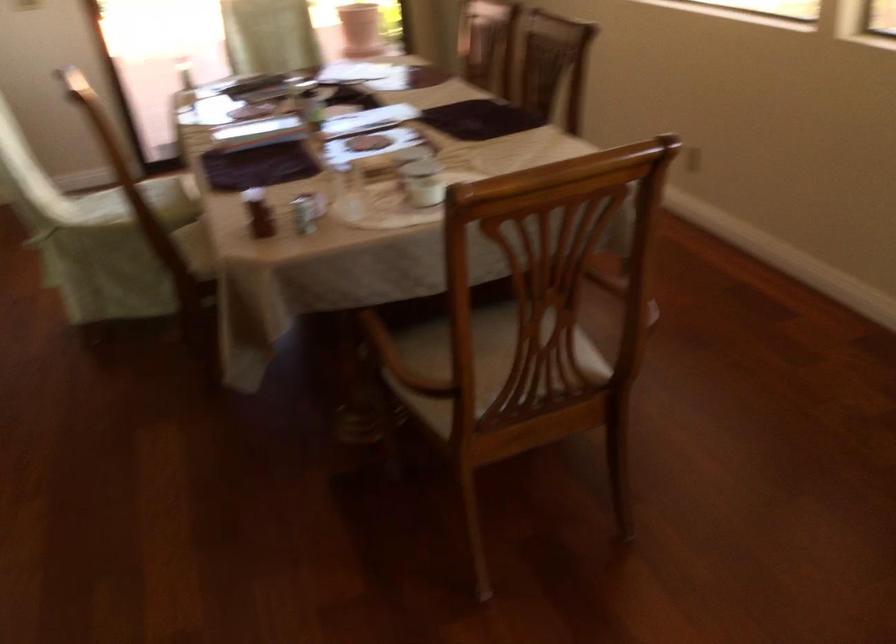
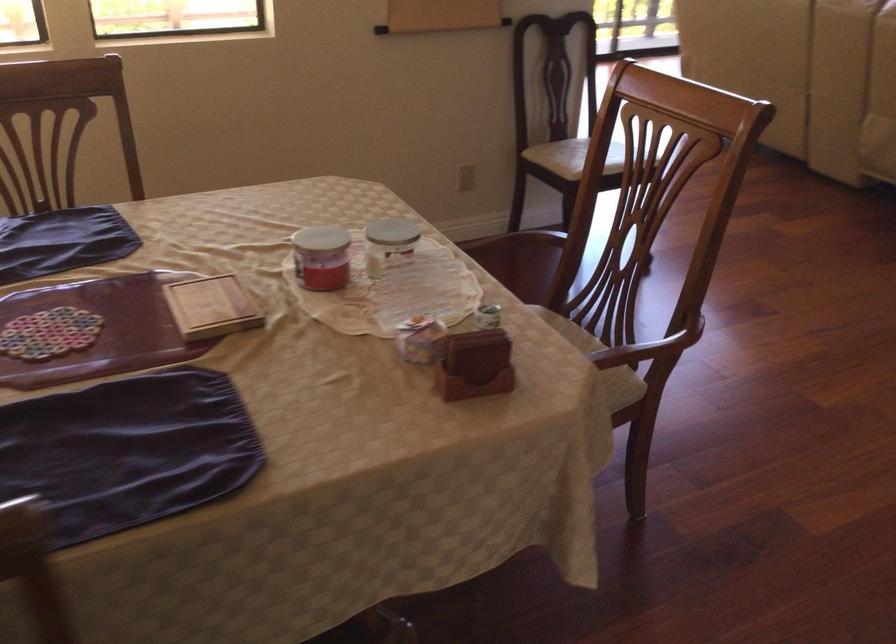
The point at (247,211) is marked in the first image. Where is the corresponding point in the second image?

(475, 365)